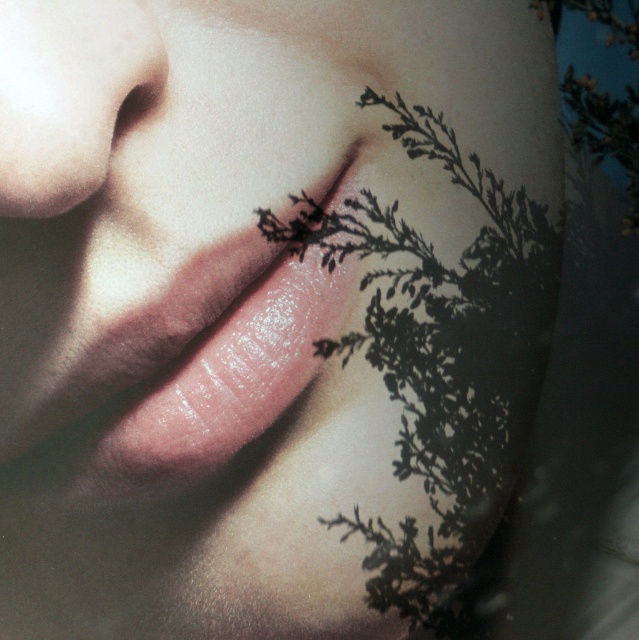
You are a makeup artist trying to apply a precise contour on the lips. The contour product you have is 5 inches long. Based on the image, will the distance between the black matte plant at lower right and the smooth skin nose at upper left be enough to fit the contour product?

The black matte plant at lower right and smooth skin nose at upper left are 5.34 inches apart, so the contour product which is 5 inches long will fit since it is shorter than the distance between them.

Based on the photo, you are a makeup artist trying to apply lipstick. You have a lipstick that is 1.2 cm wide. Can you fit the lipstick onto the glossy pink lips at center without overlapping the smooth skin nose at upper left?

The glossy pink lips at center are wider than the smooth skin nose at upper left. Since the lipstick is 1.2 cm wide, it can fit on the glossy pink lips at center without overlapping the nose as long as it is centered properly.

You are an artist trying to paint the scene. You notice two points in the image, point (417, 538) and point (73, 3). Which point is closer to your eyes?

Point (417, 538) is further to the viewer than point (73, 3), so the point closer to your eyes is point (73, 3).